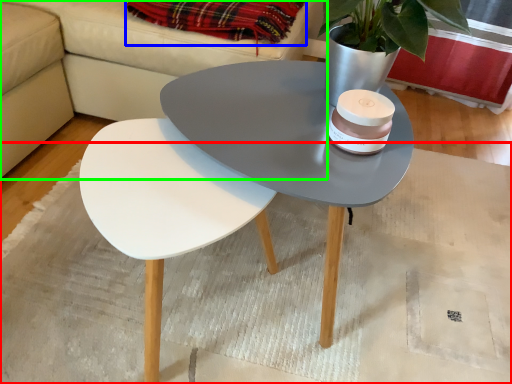
Question: Estimate the real-world distances between objects in this image. Which object is closer to mat (highlighted by a red box), blanket (highlighted by a blue box) or couch (highlighted by a green box)?

Choices:
 (A) blanket
 (B) couch

Answer: (B)